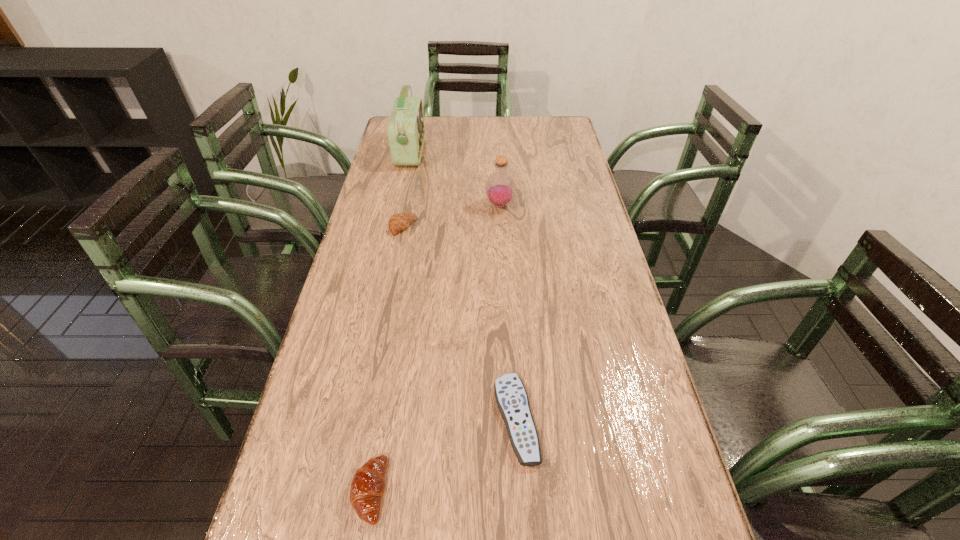
Find the location of a particular element. This screenshot has width=960, height=540. blank space located 0.050m on the left of the nearer crescent roll is located at coordinates (325, 491).

The width and height of the screenshot is (960, 540). I want to click on free location located on the left of the remote control, so click(470, 420).

The height and width of the screenshot is (540, 960). I want to click on object that is at the far edge, so click(x=405, y=129).

Locate an element on the screen. radio receiver at the left edge is located at coordinates coord(405,129).

Find the location of a particular element. object located at the far left corner is located at coordinates (405, 129).

This screenshot has width=960, height=540. I want to click on vacant space at the far edge of the desktop, so tap(530, 137).

At what (x,y) coordinates should I click in order to perform the action: click on free space at the left edge of the desktop. Please return your answer as a coordinate pair (x, y). Image resolution: width=960 pixels, height=540 pixels. Looking at the image, I should click on (383, 178).

The height and width of the screenshot is (540, 960). In the image, there is a desktop. What are the coordinates of `free space at the right edge` in the screenshot? It's located at (601, 429).

Identify the location of vacant space at the far left corner of the desktop. (428, 117).

Locate an element on the screen. The width and height of the screenshot is (960, 540). blank space at the far right corner of the desktop is located at coordinates (564, 126).